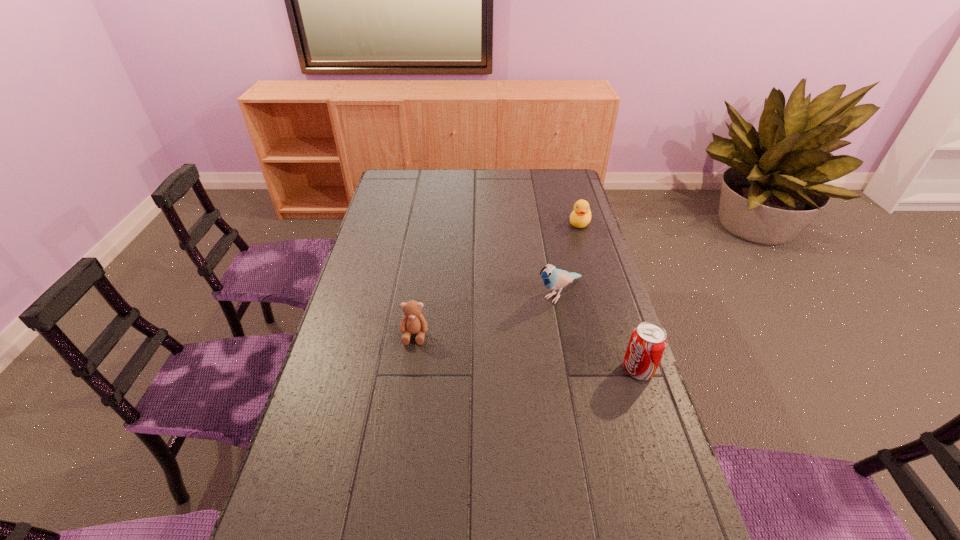
Locate an element on the screen. This screenshot has width=960, height=540. object that is the second closest to the duckling is located at coordinates (647, 344).

At what (x,y) coordinates should I click in order to perform the action: click on object that stands as the second closest to the nearest object. Please return your answer as a coordinate pair (x, y). Looking at the image, I should click on click(x=413, y=322).

Where is `blank area in the image that satisfies the following two spatial constraints: 1. on the front-facing side of the nearest object; 2. on the right side of the leftmost object`? This screenshot has height=540, width=960. blank area in the image that satisfies the following two spatial constraints: 1. on the front-facing side of the nearest object; 2. on the right side of the leftmost object is located at coordinates (410, 369).

Identify the location of free space that satisfies the following two spatial constraints: 1. on the front side of the farthest object; 2. on the right side of the soda. (624, 369).